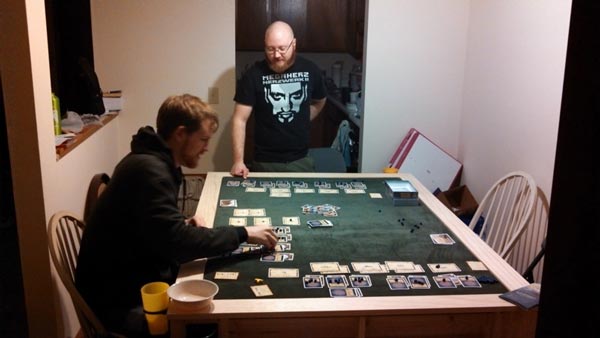
Where is `chairs`? This screenshot has width=600, height=338. chairs is located at coordinates (63, 237), (509, 217), (324, 163).